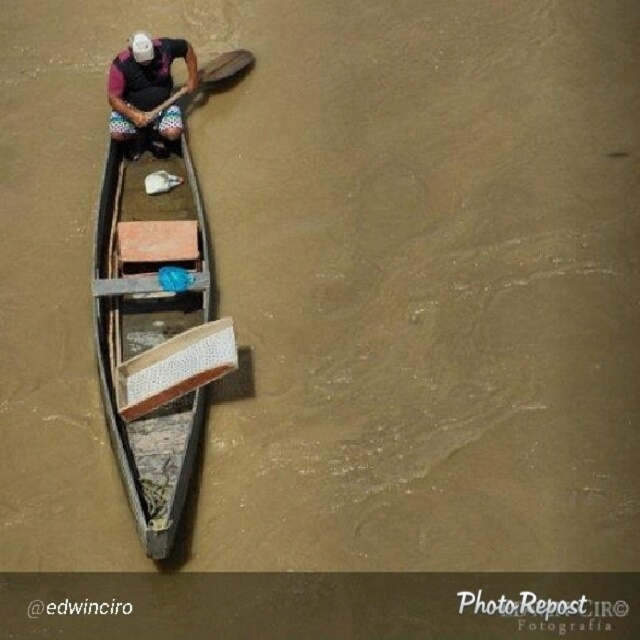
In the scene shown: Which of these two, wooden canoe at center or white matte helmet at upper center, stands taller?

wooden canoe at center is taller.

Locate an element on the screen. The width and height of the screenshot is (640, 640). wooden canoe at center is located at coordinates (148, 316).

Is wooden canoe at center above wooden paddle at center?

Actually, wooden canoe at center is below wooden paddle at center.

Is wooden canoe at center positioned in front of wooden paddle at center?

Yes, wooden canoe at center is closer to the viewer.

Which is behind, point (140, 205) or point (243, 52)?

Point (243, 52)

The width and height of the screenshot is (640, 640). In order to click on wooden canoe at center in this screenshot , I will do click(x=148, y=316).

Is white matte helmet at upper center taller than wooden paddle at center?

Yes, white matte helmet at upper center is taller than wooden paddle at center.

Is white matte helmet at upper center to the right of wooden paddle at center from the viewer's perspective?

In fact, white matte helmet at upper center is to the left of wooden paddle at center.

I want to click on white matte helmet at upper center, so click(x=147, y=92).

This screenshot has height=640, width=640. Find the location of `white matte helmet at upper center`. white matte helmet at upper center is located at coordinates (147, 92).